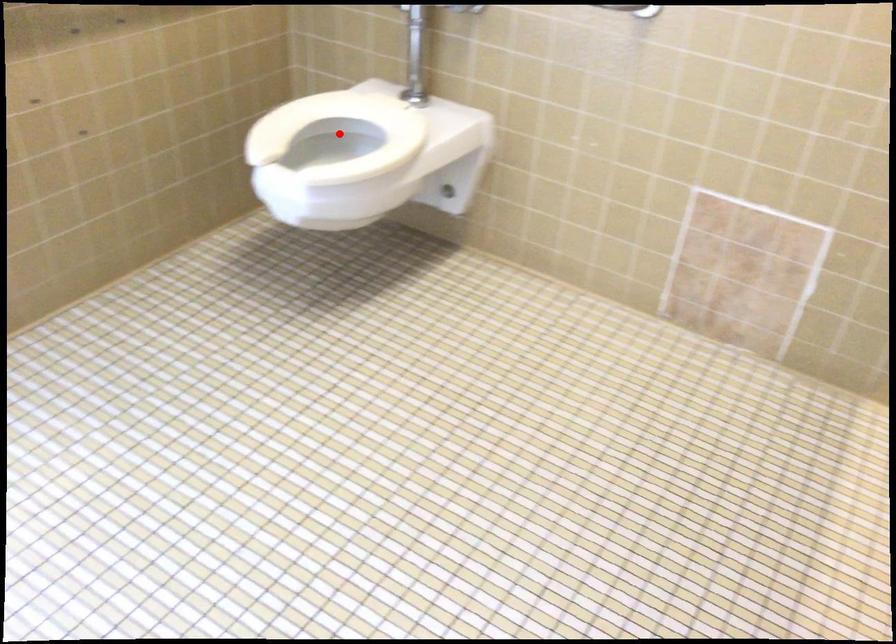
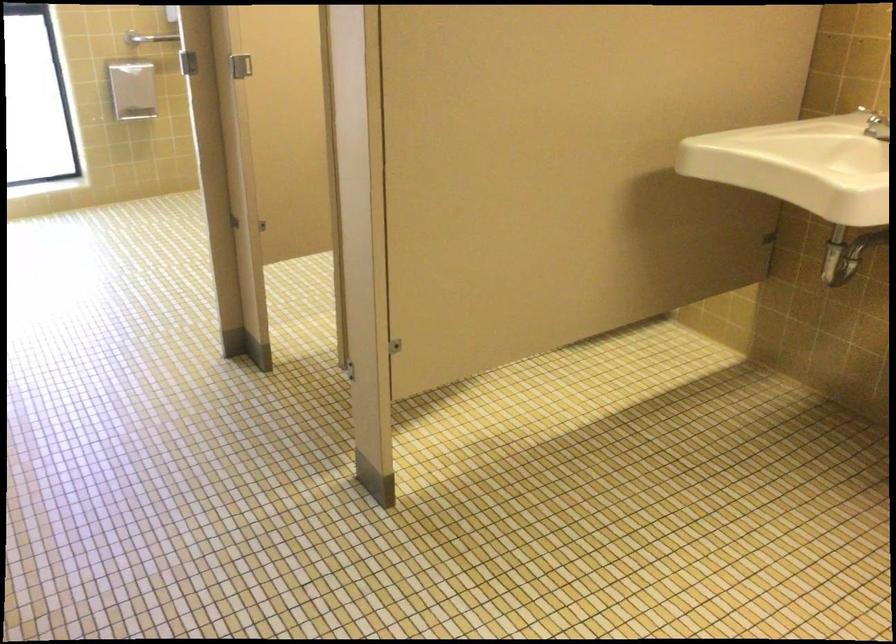
Question: I am providing you with two images of the same scene from different viewpoints. A red point is marked on the first image. At the location where the point appears in image 1, is it still visible in image 2?

Choices:
 (A) Yes
 (B) No

Answer: (B)